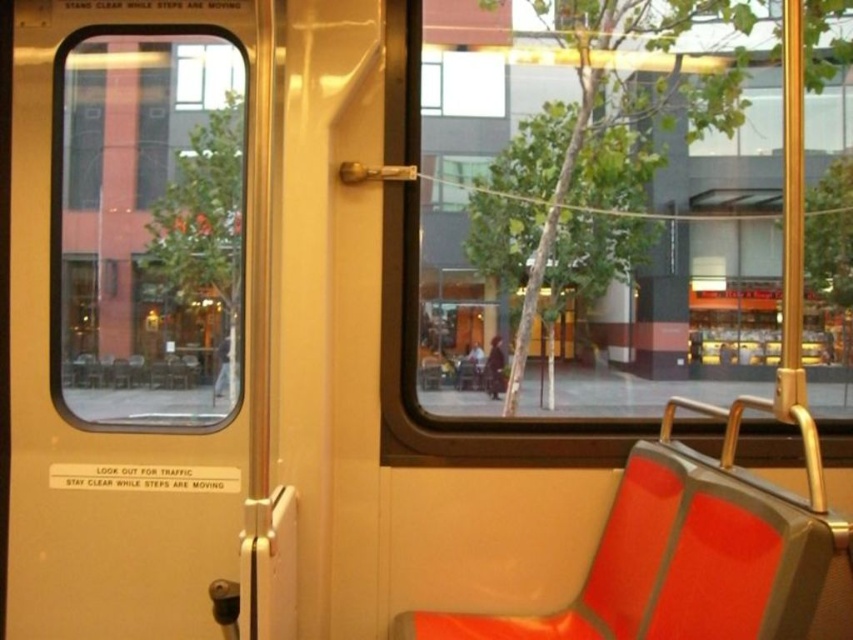
Is transparent glass window at left below orange fabric seat at right?

No, transparent glass window at left is not below orange fabric seat at right.

Does transparent glass window at left have a lesser width compared to orange fabric seat at right?

Yes.

What are the coordinates of `transparent glass window at left` in the screenshot? It's located at (151, 228).

What do you see at coordinates (695, 552) in the screenshot?
I see `orange fabric seat at right` at bounding box center [695, 552].

Does orange fabric seat at right appear under dark gray fabric coach at center?

Yes.

In order to click on orange fabric seat at right in this screenshot , I will do `click(695, 552)`.

Between point (786, 493) and point (392, 376), which one is positioned in front?

Point (786, 493) is more forward.

Between orange fabric seat at right and transparent glass window at center, which one is positioned lower?

orange fabric seat at right is below.

Which is in front, point (555, 628) or point (769, 428)?

Point (555, 628) is in front.

Find the location of a particular element. The image size is (853, 640). orange fabric seat at right is located at coordinates (695, 552).